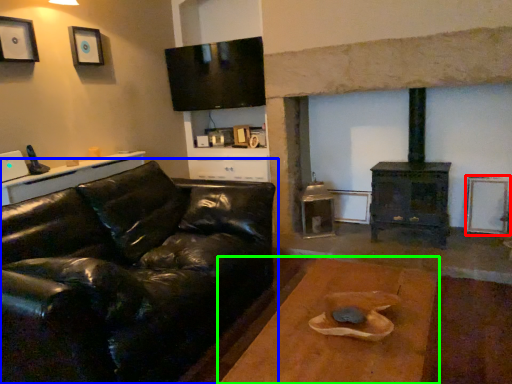
Question: Estimate the real-world distances between objects in this image. Which object is closer to picture frame (highlighted by a red box), studio couch (highlighted by a blue box) or table (highlighted by a green box)?

Choices:
 (A) studio couch
 (B) table

Answer: (B)